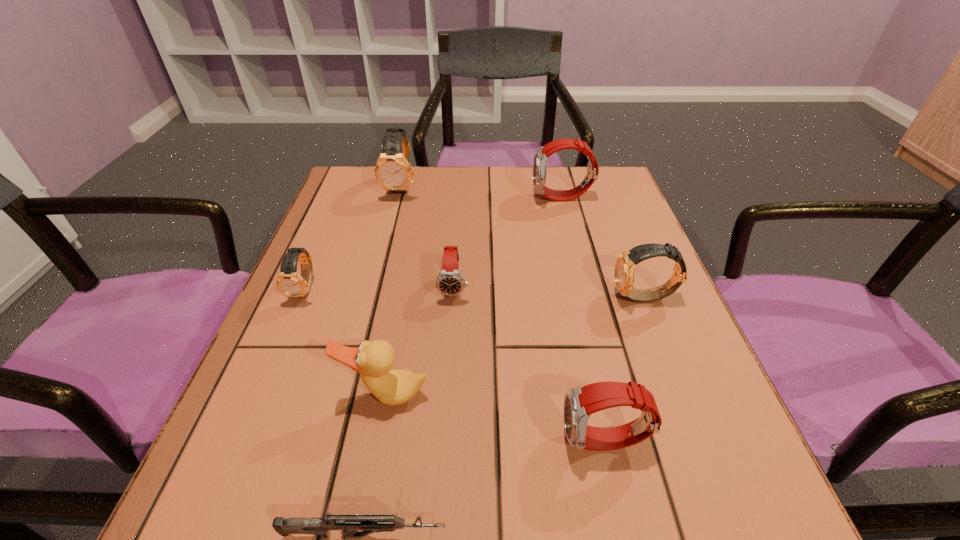
Identify the location of vacant space at the left edge of the desktop. The width and height of the screenshot is (960, 540). (346, 218).

In the image, there is a desktop. Where is `free space at the right edge`? The width and height of the screenshot is (960, 540). free space at the right edge is located at coordinates (676, 414).

The height and width of the screenshot is (540, 960). Find the location of `free space at the far left corner of the desktop`. free space at the far left corner of the desktop is located at coordinates (332, 212).

You are a GUI agent. You are given a task and a screenshot of the screen. Output one action in this format:
    pyautogui.click(x=<x>, y=<y>)
    Task: Click on the free space at the far right corner of the desktop
    The height and width of the screenshot is (540, 960).
    Given the screenshot: What is the action you would take?
    pyautogui.click(x=602, y=206)

Where is `blank space at the near right corner`? The width and height of the screenshot is (960, 540). blank space at the near right corner is located at coordinates (718, 482).

Find the location of a particular element. free spot between the farthest red watch and the tan duck is located at coordinates (474, 296).

Identify the location of blank region between the second smallest gold watch and the biggest gold watch. (523, 242).

I want to click on free space that is in between the second smallest red watch and the second biggest gold watch, so click(625, 370).

Find the location of a particular element. Image resolution: width=960 pixels, height=540 pixels. vacant area that lies between the tan duck and the smallest gold watch is located at coordinates (346, 342).

In order to click on free space between the smallest red watch and the second nearest object in this screenshot , I will do `click(529, 364)`.